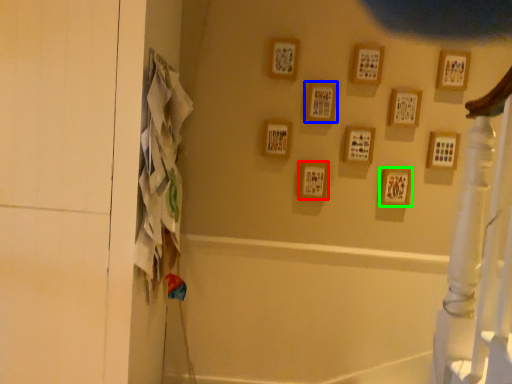
Question: Which object is the farthest from picture frame (highlighted by a red box)? Choose among these: picture frame (highlighted by a blue box) or picture frame (highlighted by a green box).

Choices:
 (A) picture frame
 (B) picture frame

Answer: (B)